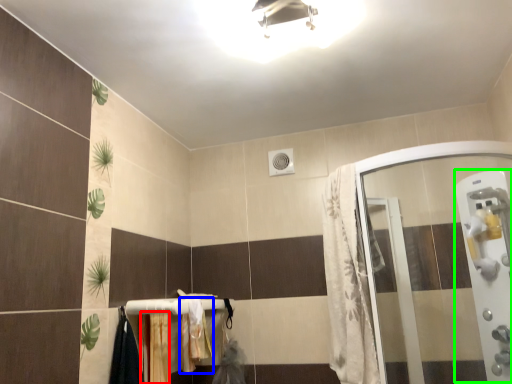
Question: Which object is positioned closest to curtain (highlighted by a red box)? Select from bath towel (highlighted by a blue box) and screen door (highlighted by a green box).

Choices:
 (A) bath towel
 (B) screen door

Answer: (A)